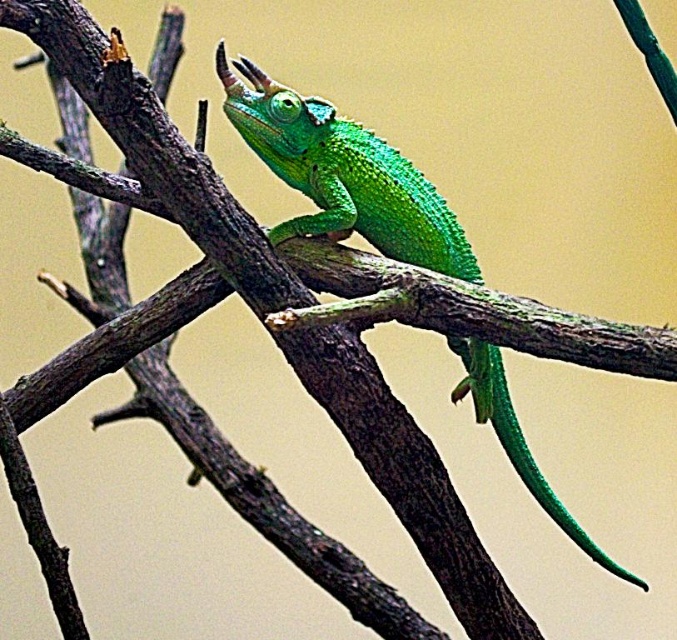
Based on the photo, you are a biologist observing the green scaly lizard at center and the green scaly tail at center in the image. Which one is positioned higher from the ground?

The green scaly lizard at center is located above the green scaly tail at center, so the green scaly lizard at center is positioned higher from the ground.

You are observing a chameleon on a branch. There are two points marked on the image at coordinates point (399, 177) and point (496, 362). From your perspective, which point is closer to you?

Point (399, 177) is in front of point (496, 362), so it is closer to you.

You are a wildlife photographer aiming to capture a closeup shot of the green scaly lizard at center and the green scaly tail at center. Your camera has a maximum focus range of 10 centimeters. Can you capture both subjects in focus at the same time?

The green scaly lizard at center and green scaly tail at center are 12.71 centimeters apart. Since the distance between them exceeds the camera maximum focus range of 10 centimeters, you cannot capture both subjects in focus simultaneously.